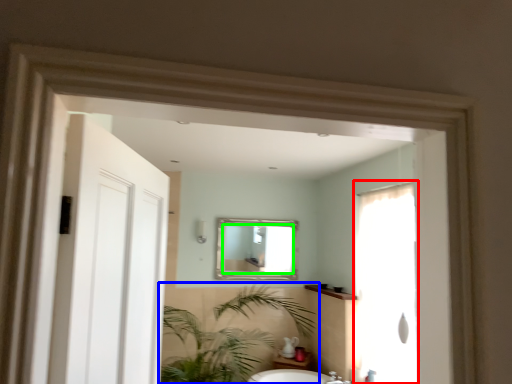
Question: Which object is positioned closest to screen door (highlighted by a red box)? Select from houseplant (highlighted by a blue box) and mirror (highlighted by a green box).

Choices:
 (A) houseplant
 (B) mirror

Answer: (A)